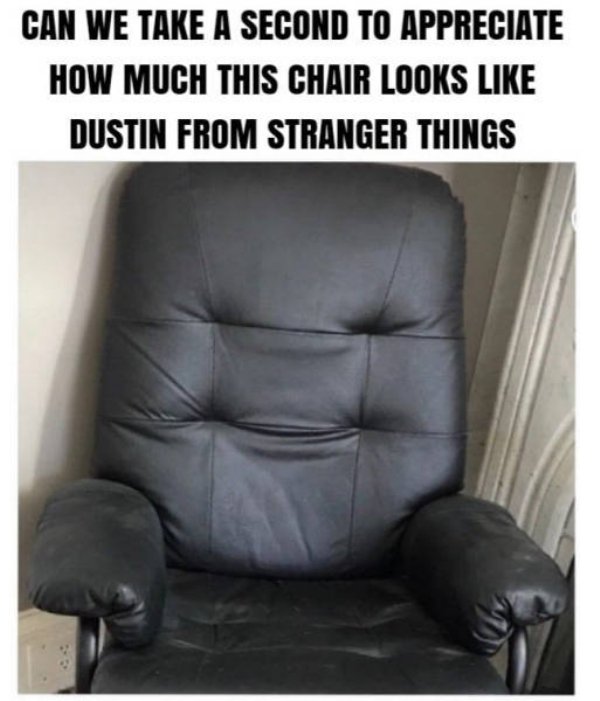
You are a GUI agent. You are given a task and a screenshot of the screen. Output one action in this format:
    pyautogui.click(x=<x>, y=<y>)
    Task: Click on the electrical socket
    Image resolution: width=600 pixels, height=701 pixels.
    Given the screenshot: What is the action you would take?
    click(63, 667)